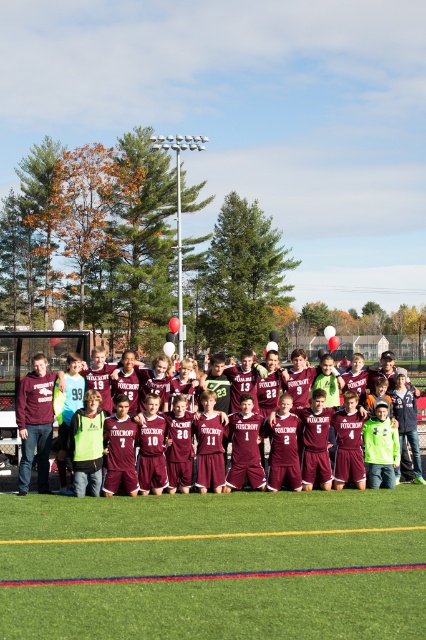
Question: Is green artificial turf at center above maroon jersey at center?

Choices:
 (A) yes
 (B) no

Answer: (B)

Question: Is green artificial turf at center positioned at the back of maroon jersey at center?

Choices:
 (A) no
 (B) yes

Answer: (A)

Question: Is green artificial turf at center closer to the viewer compared to maroon jersey at center?

Choices:
 (A) yes
 (B) no

Answer: (A)